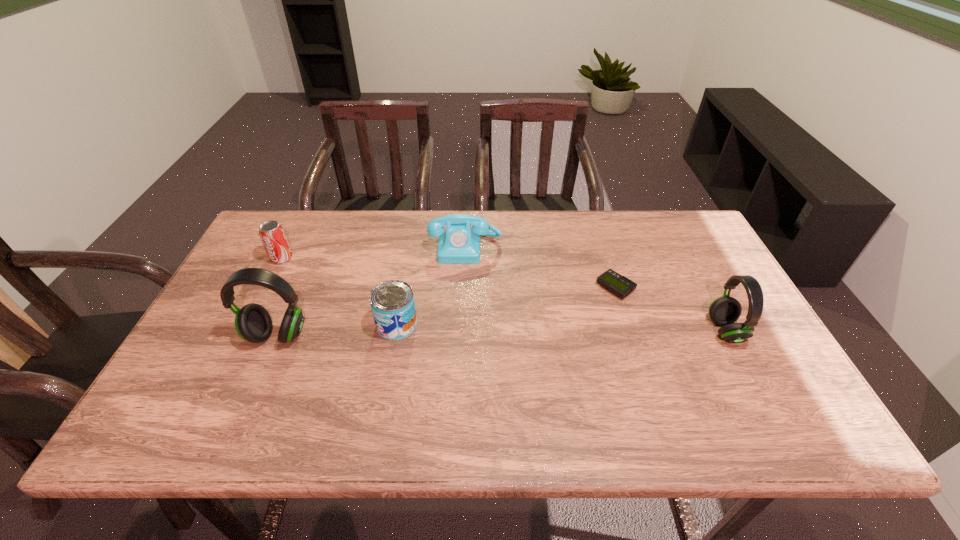
Find the location of a particular element. This screenshot has height=540, width=960. the taller headset is located at coordinates (253, 323).

In order to click on the tallest object in this screenshot , I will do `click(253, 323)`.

Where is `the right headset`? Image resolution: width=960 pixels, height=540 pixels. the right headset is located at coordinates (724, 311).

Identify the location of the shorter headset. (724, 311).

The height and width of the screenshot is (540, 960). Find the location of `soda can`. soda can is located at coordinates (273, 237).

You are a GUI agent. You are given a task and a screenshot of the screen. Output one action in this format:
    pyautogui.click(x=<x>, y=<y>)
    Task: Click on the shortest object
    The image size is (960, 540).
    Given the screenshot: What is the action you would take?
    pyautogui.click(x=619, y=285)

In order to click on the second object from right to left in this screenshot , I will do `click(619, 285)`.

The image size is (960, 540). I want to click on telephone, so click(x=460, y=244).

Where is `the fourth object from right to left`? The width and height of the screenshot is (960, 540). the fourth object from right to left is located at coordinates (392, 302).

The image size is (960, 540). In order to click on blank area located 0.050m on the ear cups of the right headset in this screenshot , I will do `click(760, 331)`.